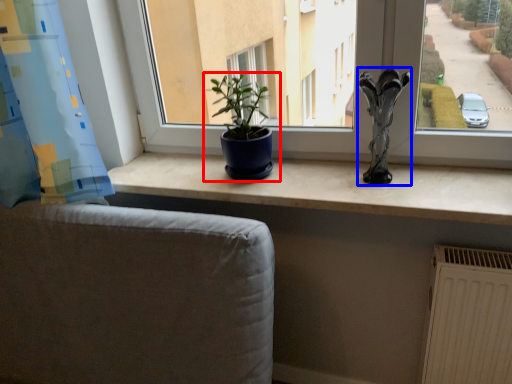
Question: Which of the following is the closest to the observer, houseplant (highlighted by a red box) or sculpture (highlighted by a blue box)?

Choices:
 (A) houseplant
 (B) sculpture

Answer: (B)